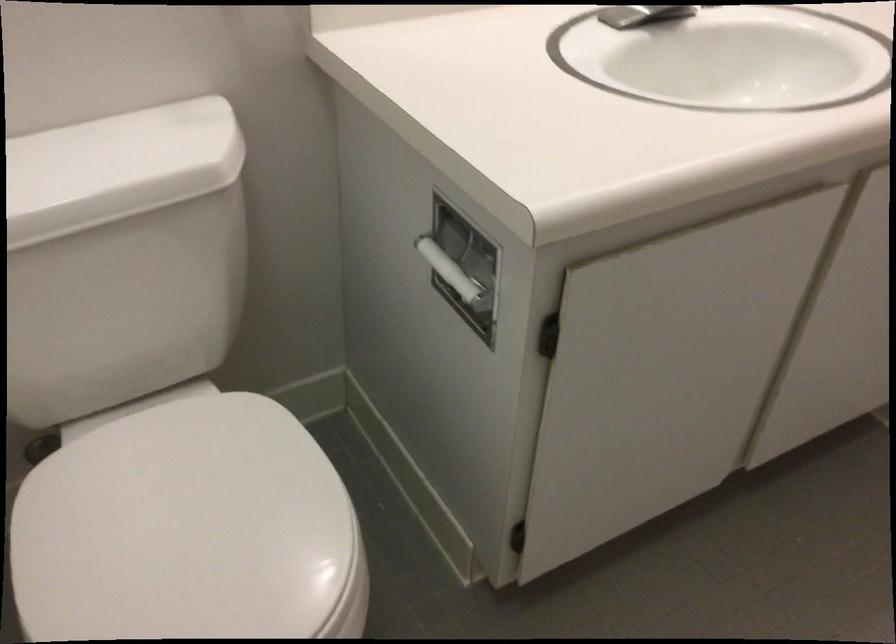
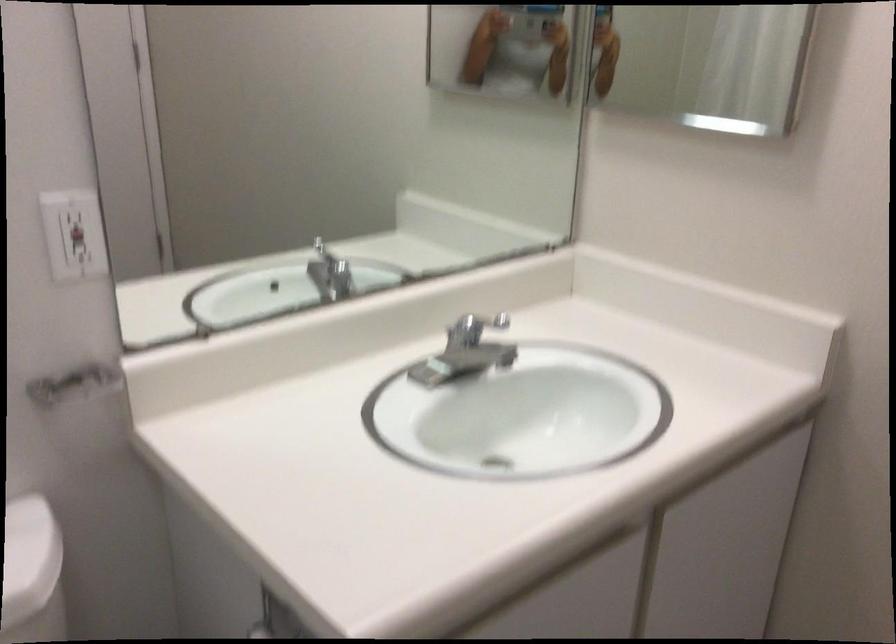
The point at [431,238] is marked in the first image. Where is the corresponding point in the second image?

(259, 630)